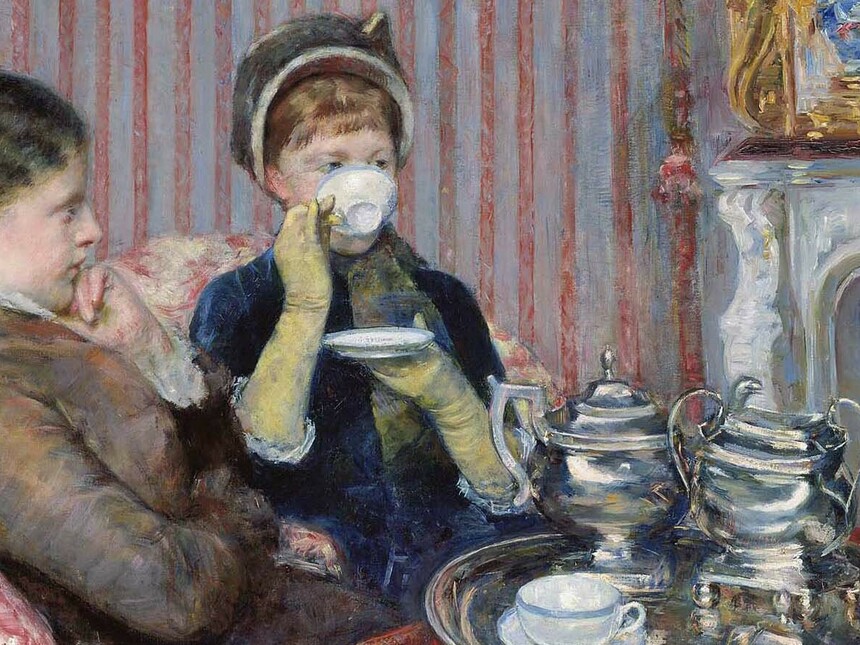
Find the location of a particular element. This screenshot has height=645, width=860. silver platter is located at coordinates (688, 622).